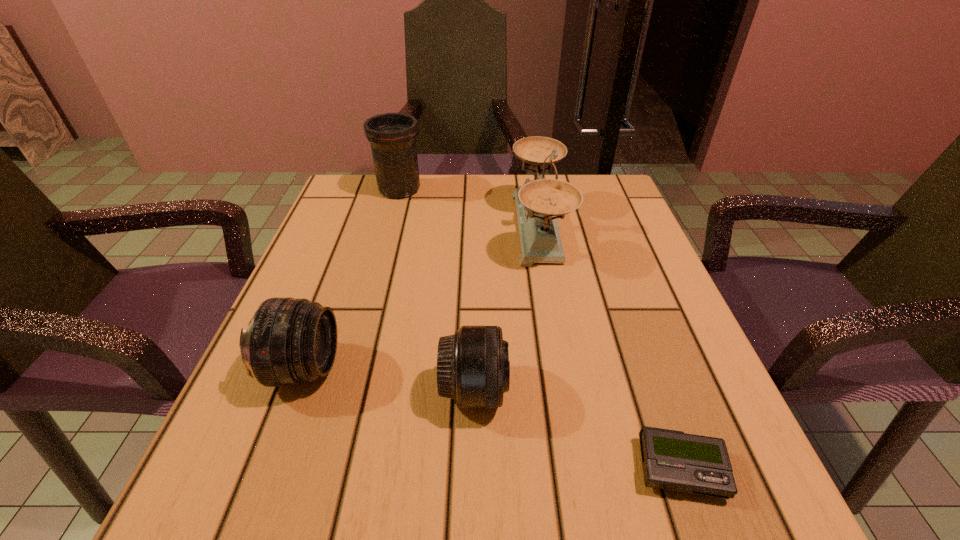
What are the coordinates of `telephoto lens that is the third closest to the rightmost object` in the screenshot? It's located at (392, 136).

Find the location of `vacant space that satisfies the following two spatial constraints: 1. on the front side of the tallest telephoto lens; 2. on the right side of the nearest object`. vacant space that satisfies the following two spatial constraints: 1. on the front side of the tallest telephoto lens; 2. on the right side of the nearest object is located at coordinates (324, 469).

This screenshot has height=540, width=960. I want to click on free space that satisfies the following two spatial constraints: 1. on the front-facing side of the nearest object; 2. on the right side of the fourth object from left to right, so click(581, 469).